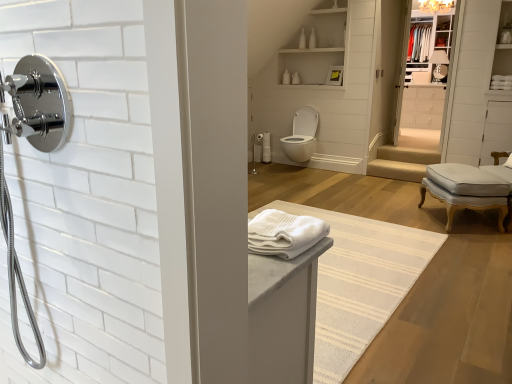
Question: Considering the relative positions of beige fabric stair at center and polished chrome showerhead at left, which ranks as the 1th shower in bottom-to-top order, in the image provided, is beige fabric stair at center to the right of polished chrome showerhead at left, which ranks as the 1th shower in bottom-to-top order, from the viewer's perspective?

Choices:
 (A) yes
 (B) no

Answer: (A)

Question: Does beige fabric stair at center have a lesser height compared to polished chrome showerhead at left, which ranks as the second shower in back-to-front order?

Choices:
 (A) no
 (B) yes

Answer: (B)

Question: Is beige fabric stair at center smaller than polished chrome showerhead at left, positioned as the first shower in left-to-right order?

Choices:
 (A) yes
 (B) no

Answer: (B)

Question: Is beige fabric stair at center at the left side of polished chrome showerhead at left, the second shower from the right?

Choices:
 (A) no
 (B) yes

Answer: (A)

Question: Is beige fabric stair at center surrounding polished chrome showerhead at left, which ranks as the 1th shower in bottom-to-top order?

Choices:
 (A) no
 (B) yes

Answer: (A)

Question: From the image's perspective, is white glossy medicine cabinet at upper right, which is the second medicine cabinet in left-to-right order, positioned above or below matte white light fixture at upper center?

Choices:
 (A) below
 (B) above

Answer: (A)

Question: Considering the positions of white glossy medicine cabinet at upper right, placed as the first medicine cabinet when sorted from back to front, and matte white light fixture at upper center in the image, is white glossy medicine cabinet at upper right, placed as the first medicine cabinet when sorted from back to front, taller or shorter than matte white light fixture at upper center?

Choices:
 (A) tall
 (B) short

Answer: (A)

Question: Choose the correct answer: Is white glossy medicine cabinet at upper right, the second medicine cabinet from the bottom, inside matte white light fixture at upper center or outside it?

Choices:
 (A) inside
 (B) outside

Answer: (B)

Question: Based on their sizes in the image, would you say white glossy medicine cabinet at upper right, the second medicine cabinet from the bottom, is bigger or smaller than matte white light fixture at upper center?

Choices:
 (A) small
 (B) big

Answer: (B)

Question: From a real-world perspective, is light gray fabric ottoman at right positioned above or below white cotton bath towel at center, which is the second bath towel from bottom to top?

Choices:
 (A) above
 (B) below

Answer: (B)

Question: In terms of height, does light gray fabric ottoman at right look taller or shorter compared to white cotton bath towel at center, marked as the first bath towel in a back-to-front arrangement?

Choices:
 (A) short
 (B) tall

Answer: (A)

Question: Looking at their shapes, would you say light gray fabric ottoman at right is wider or thinner than white cotton bath towel at center, arranged as the first bath towel when viewed from the right?

Choices:
 (A) thin
 (B) wide

Answer: (B)

Question: From the image's perspective, is light gray fabric ottoman at right above or below white cotton bath towel at center, which is the 1th bath towel in top-to-bottom order?

Choices:
 (A) above
 (B) below

Answer: (B)

Question: From a real-world perspective, is white glossy cabinet at upper right physically located above or below white cotton bath towel at center, arranged as the first bath towel when viewed from the right?

Choices:
 (A) above
 (B) below

Answer: (B)

Question: Considering the positions of white glossy cabinet at upper right and white cotton bath towel at center, arranged as the first bath towel when viewed from the right, in the image, is white glossy cabinet at upper right bigger or smaller than white cotton bath towel at center, arranged as the first bath towel when viewed from the right,?

Choices:
 (A) small
 (B) big

Answer: (B)